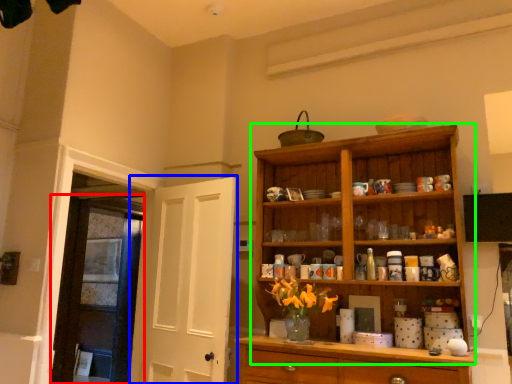
Question: Which object is the farthest from door (highlighted by a red box)? Choose among these: door (highlighted by a blue box) or cupboard (highlighted by a green box).

Choices:
 (A) door
 (B) cupboard

Answer: (B)